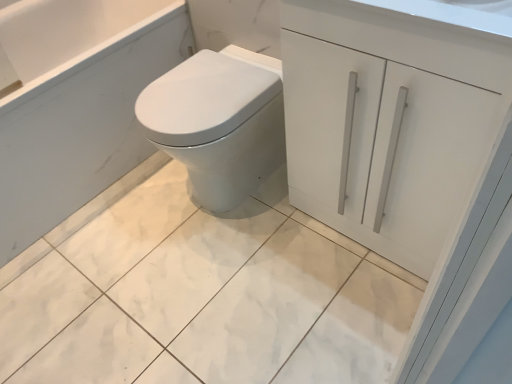
This screenshot has height=384, width=512. I want to click on white glossy cabinet at upper right, so click(x=406, y=145).

Where is `white glossy bidet at center`? white glossy bidet at center is located at coordinates (217, 125).

Identify the location of white glossy cabinet at upper right. Image resolution: width=512 pixels, height=384 pixels. (406, 145).

Is white glossy cabinet at upper right looking in the opposite direction of white marble tile at center?

That's not correct — white glossy cabinet at upper right is not looking away from white marble tile at center.

Is white glossy cabinet at upper right wider than white marble tile at center?

No.

Considering the relative positions of white glossy cabinet at upper right and white marble tile at center in the image provided, is white glossy cabinet at upper right to the right of white marble tile at center from the viewer's perspective?

Yes, white glossy cabinet at upper right is to the right of white marble tile at center.

From a real-world perspective, who is located higher, white glossy cabinet at upper right or white marble tile at center?

In real-world perspective, white glossy cabinet at upper right is above.

Is white glossy cabinet at upper right surrounded by white glossy bidet at center?

Actually, white glossy cabinet at upper right is outside white glossy bidet at center.

Considering the sizes of objects white glossy bidet at center and white glossy cabinet at upper right in the image provided, who is wider, white glossy bidet at center or white glossy cabinet at upper right?

white glossy bidet at center is wider.

Measure the distance from white glossy bidet at center to white glossy cabinet at upper right.

white glossy bidet at center and white glossy cabinet at upper right are 33.53 centimeters apart from each other.

Between white glossy bidet at center and white glossy cabinet at upper right, which one has less height?

white glossy bidet at center.

How far apart are white glossy cabinet at upper right and white glossy cabinet at upper right?

white glossy cabinet at upper right is 6.38 inches away from white glossy cabinet at upper right.

Is white glossy cabinet at upper right positioned with its back to white glossy cabinet at upper right?

That's right, white glossy cabinet at upper right is facing away from white glossy cabinet at upper right.

Does white glossy cabinet at upper right lie in front of white glossy cabinet at upper right?

Yes, white glossy cabinet at upper right is closer to the camera.

Is white glossy cabinet at upper right inside white glossy cabinet at upper right?

No.

From a real-world perspective, which is physically above, white marble tile at center or white glossy cabinet at upper right?

white glossy cabinet at upper right is physically above.

Who is bigger, white marble tile at center or white glossy cabinet at upper right?

white marble tile at center is bigger.

From the image's perspective, is white marble tile at center positioned above or below white glossy cabinet at upper right?

Clearly, from the image's perspective, white marble tile at center is below white glossy cabinet at upper right.

Is white glossy bidet at center outside of white marble tile at center?

Yes, white glossy bidet at center is outside of white marble tile at center.

From their relative heights in the image, would you say white glossy bidet at center is taller or shorter than white marble tile at center?

Considering their sizes, white glossy bidet at center has more height than white marble tile at center.

Consider the image. From the image's perspective, which object appears higher, white glossy bidet at center or white marble tile at center?

white glossy bidet at center, from the image's perspective.

Between white glossy bidet at center and white marble tile at center, which one is positioned in front?

Positioned in front is white marble tile at center.

Which object is wider, white glossy cabinet at upper right or white glossy bidet at center?

With larger width is white glossy bidet at center.

Based on the photo, looking at the image, does white glossy cabinet at upper right seem bigger or smaller compared to white glossy bidet at center?

In the image, white glossy cabinet at upper right appears to be larger than white glossy bidet at center.

Is white glossy cabinet at upper right taller or shorter than white glossy bidet at center?

In the image, white glossy cabinet at upper right appears to be taller than white glossy bidet at center.

Which object is further away from the camera, white marble tile at center or white glossy bidet at center?

white glossy bidet at center is further from the camera.

Does white marble tile at center have a lesser height compared to white glossy bidet at center?

Yes, white marble tile at center is shorter than white glossy bidet at center.

Is point (40, 373) closer or farther from the camera than point (246, 89)?

Point (40, 373) appears to be closer to the viewer than point (246, 89).

Identify the location of ceramic tile below the white glossy cabinet at upper right (from a real-world perspective). Image resolution: width=512 pixels, height=384 pixels. (205, 297).

This screenshot has height=384, width=512. Find the location of `bidet on the left of white glossy cabinet at upper right`. bidet on the left of white glossy cabinet at upper right is located at coordinates (217, 125).

Looking at the image, which one is located further to white glossy cabinet at upper right, white glossy bidet at center or white glossy cabinet at upper right?

white glossy bidet at center lies further to white glossy cabinet at upper right than the other object.

Looking at the image, which one is located closer to white glossy cabinet at upper right, white glossy bidet at center or white marble tile at center?

white glossy bidet at center is positioned closer to the anchor white glossy cabinet at upper right.

Looking at the image, which one is located further to white glossy cabinet at upper right, white marble tile at center or white glossy bidet at center?

The object further to white glossy cabinet at upper right is white marble tile at center.

Estimate the real-world distances between objects in this image. Which object is closer to white marble tile at center, white glossy bidet at center or white glossy cabinet at upper right?

Based on the image, white glossy bidet at center appears to be nearer to white marble tile at center.

In the scene shown: When comparing their distances from white glossy bidet at center, does white marble tile at center or white glossy cabinet at upper right seem further?

The object further to white glossy bidet at center is white glossy cabinet at upper right.

Based on their spatial positions, is white marble tile at center or white glossy cabinet at upper right further from white glossy cabinet at upper right?

Among the two, white marble tile at center is located further to white glossy cabinet at upper right.

Looking at the image, which one is located further to white marble tile at center, white glossy cabinet at upper right or white glossy cabinet at upper right?

white glossy cabinet at upper right.

From the image, which object appears to be nearer to white glossy bidet at center, white glossy cabinet at upper right or white glossy cabinet at upper right?

white glossy cabinet at upper right is positioned closer to the anchor white glossy bidet at center.

In order to click on bathroom cabinet between white glossy cabinet at upper right and white marble tile at center in the vertical direction in this screenshot , I will do `click(406, 145)`.

The height and width of the screenshot is (384, 512). Find the location of `bidet between white glossy cabinet at upper right and white marble tile at center from top to bottom`. bidet between white glossy cabinet at upper right and white marble tile at center from top to bottom is located at coordinates (217, 125).

Where is `bidet situated between white marble tile at center and white glossy cabinet at upper right from left to right`? Image resolution: width=512 pixels, height=384 pixels. bidet situated between white marble tile at center and white glossy cabinet at upper right from left to right is located at coordinates click(217, 125).

The image size is (512, 384). I want to click on drawer between white glossy bidet at center and white glossy cabinet at upper right from left to right, so click(406, 40).